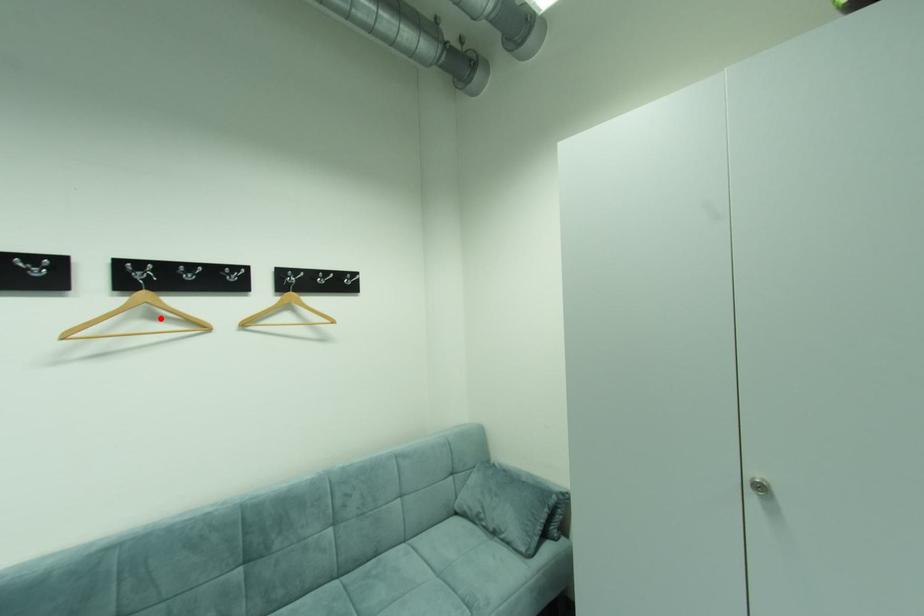
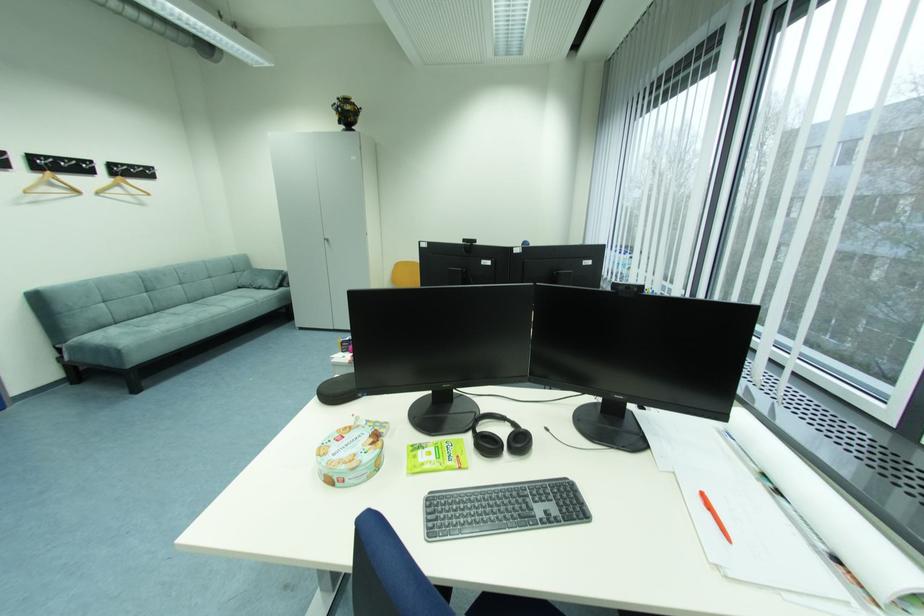
Question: A red point is marked in image1. In image2, is the corresponding 3D point closer to the camera or farther? Reply with the corresponding letter.

Choices:
 (A) The corresponding 3D point is closer.
 (B) The corresponding 3D point is farther.

Answer: (B)